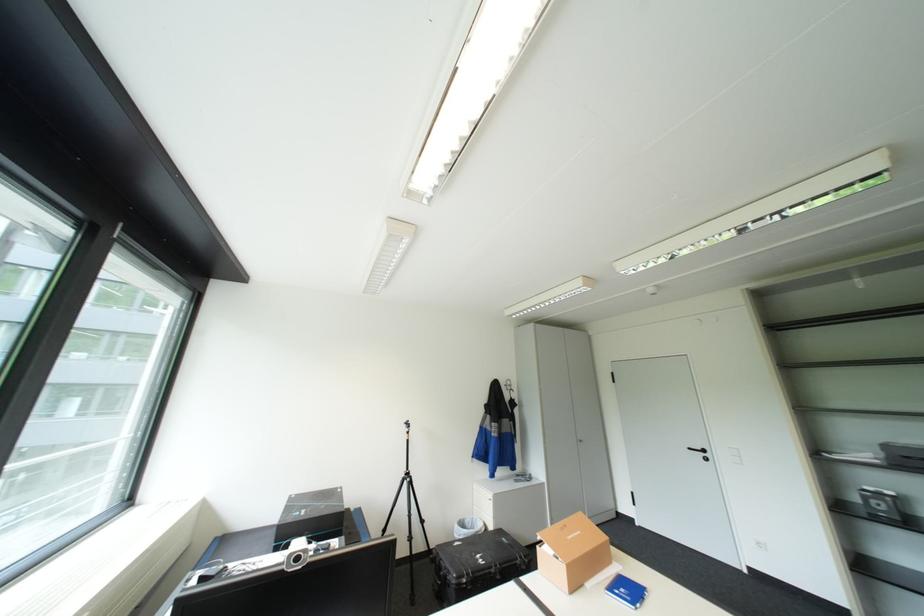
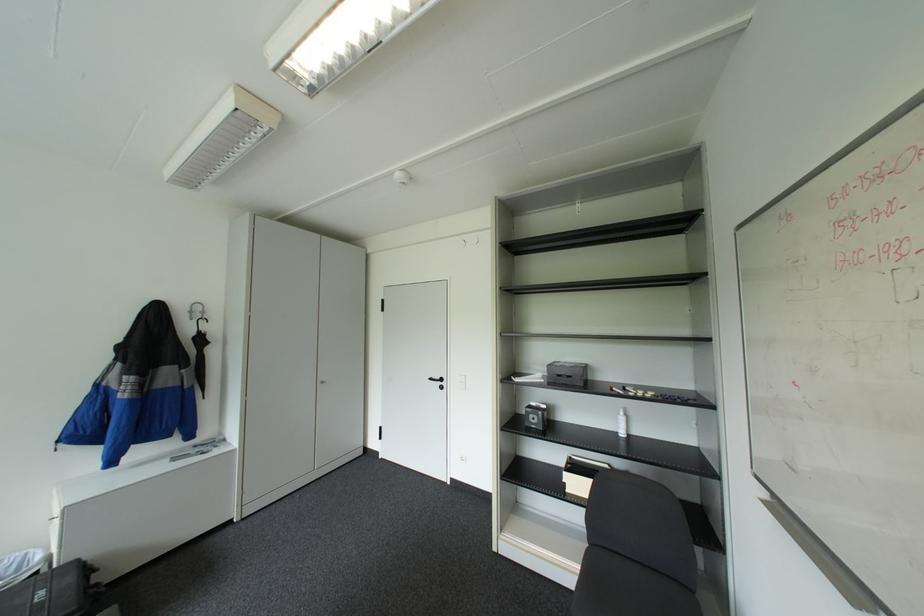
The point at (698, 447) is marked in the first image. Where is the corresponding point in the second image?

(439, 378)